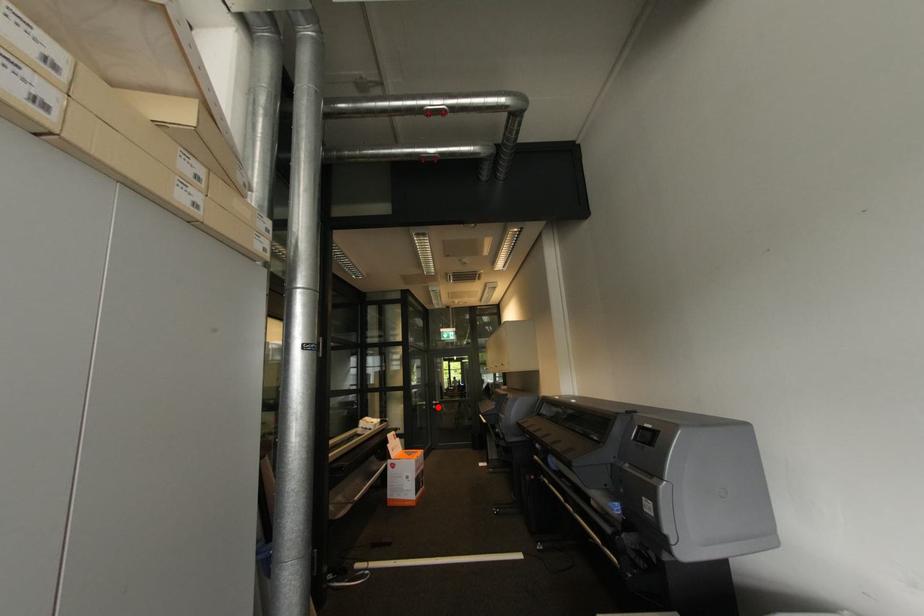
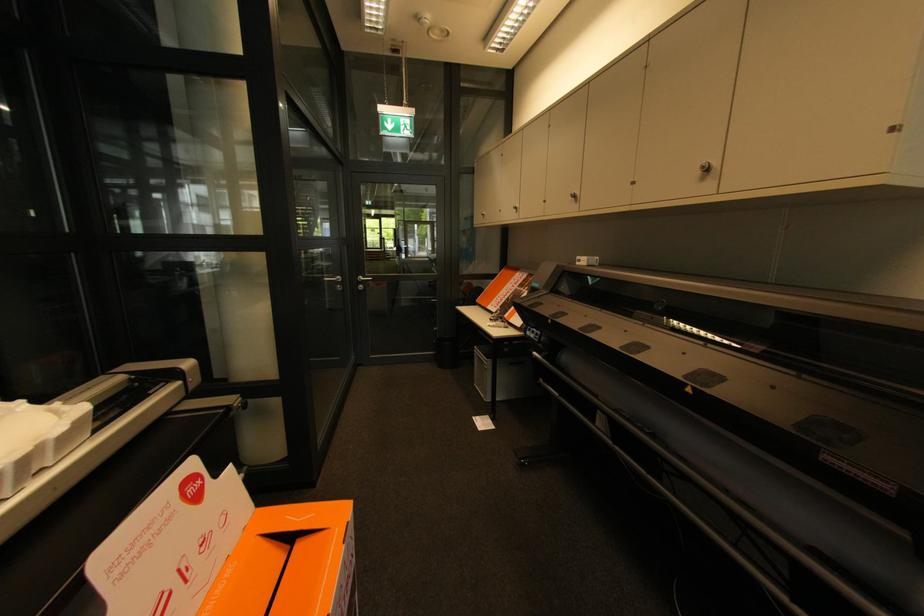
Where in the second image is the point corresponding to the highlighted location from the first image?

(365, 286)